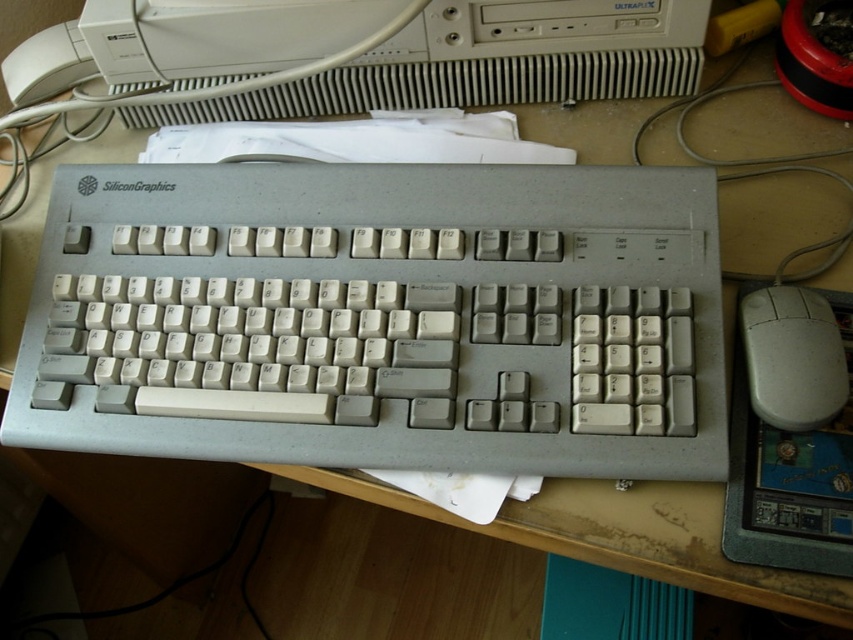
Question: Where is white plastic keyboard at center located in relation to white plastic mouse at right in the image?

Choices:
 (A) below
 (B) above

Answer: (B)

Question: Does white plastic keyboard at center appear on the right side of white plastic mouse at right?

Choices:
 (A) no
 (B) yes

Answer: (A)

Question: Estimate the real-world distances between objects in this image. Which object is farther from the white plastic desktop computer at upper center?

Choices:
 (A) white plastic mouse at right
 (B) white plastic keyboard at center

Answer: (A)

Question: Can you confirm if white plastic keyboard at center is positioned to the left of white plastic desktop computer at upper center?

Choices:
 (A) yes
 (B) no

Answer: (B)

Question: Which object is farther from the camera taking this photo?

Choices:
 (A) white plastic mouse at right
 (B) white plastic keyboard at center

Answer: (B)

Question: Which point appears closest to the camera in this image?

Choices:
 (A) (277, 211)
 (B) (550, 0)
 (C) (837, 388)

Answer: (C)